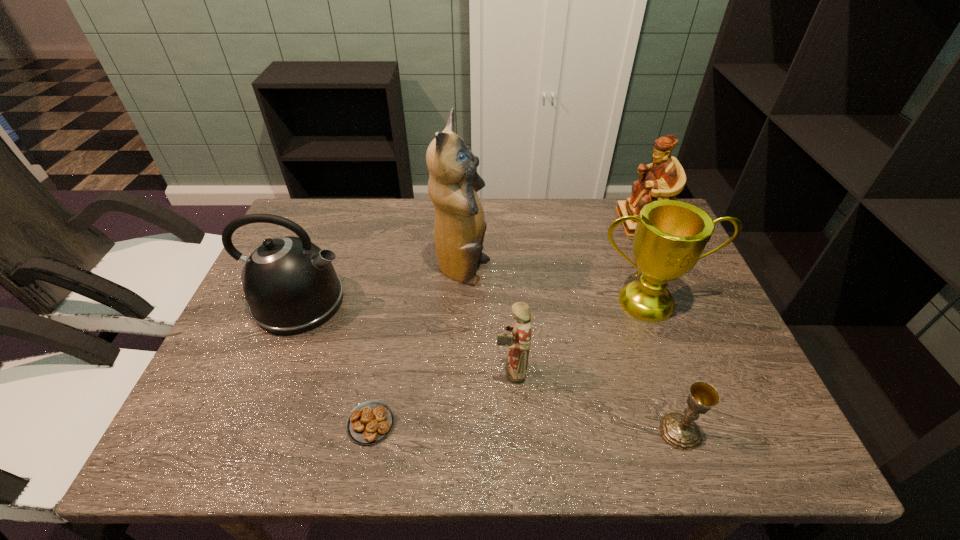
The width and height of the screenshot is (960, 540). Identify the location of empty space between the leftmost object and the pastry. (335, 362).

This screenshot has width=960, height=540. Identify the location of empty location between the shortest object and the nearer figurine. (441, 397).

In order to click on free area in between the pastry and the right figurine in this screenshot , I will do `click(506, 323)`.

This screenshot has height=540, width=960. What are the coordinates of `free spot between the sixth tallest object and the third shortest object` in the screenshot? It's located at (595, 401).

This screenshot has height=540, width=960. In order to click on free space between the chalice and the pastry in this screenshot , I will do `click(525, 427)`.

You are a GUI agent. You are given a task and a screenshot of the screen. Output one action in this format:
    pyautogui.click(x=<x>, y=<y>)
    Task: Click on the vacant space that is in between the chalice and the cat
    The height and width of the screenshot is (540, 960).
    Given the screenshot: What is the action you would take?
    (571, 352)

This screenshot has width=960, height=540. Find the location of `object that can be found as the sixth closest to the pastry`. object that can be found as the sixth closest to the pastry is located at coordinates (665, 178).

Where is `object identified as the fifth closest to the cat`? Image resolution: width=960 pixels, height=540 pixels. object identified as the fifth closest to the cat is located at coordinates (665, 178).

Find the location of a particular element. Image resolution: width=960 pixels, height=540 pixels. free location that satisfies the following two spatial constraints: 1. on the back side of the second shortest object; 2. on the face of the cat is located at coordinates (625, 272).

In order to click on free spot that satisfies the following two spatial constraints: 1. on the front-facing side of the third shortest object; 2. on the front side of the second object from left to right in this screenshot , I will do pyautogui.click(x=514, y=423).